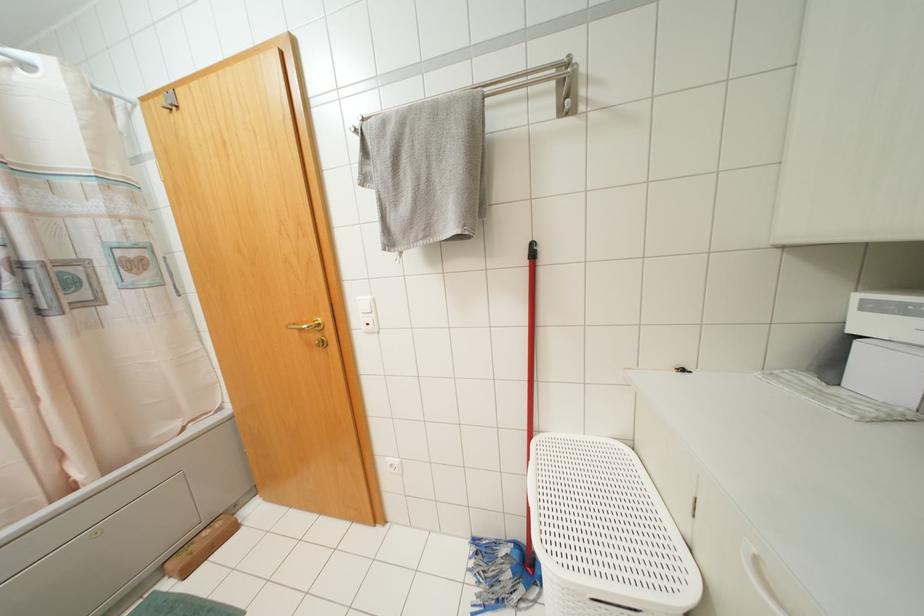
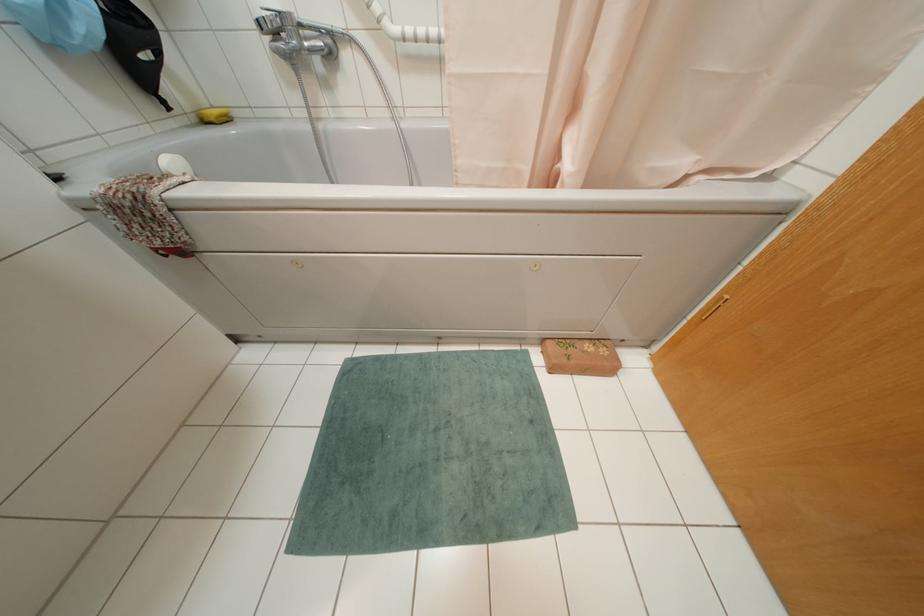
In the second image, find the point that corresponds to [217,523] in the first image.

(602, 351)